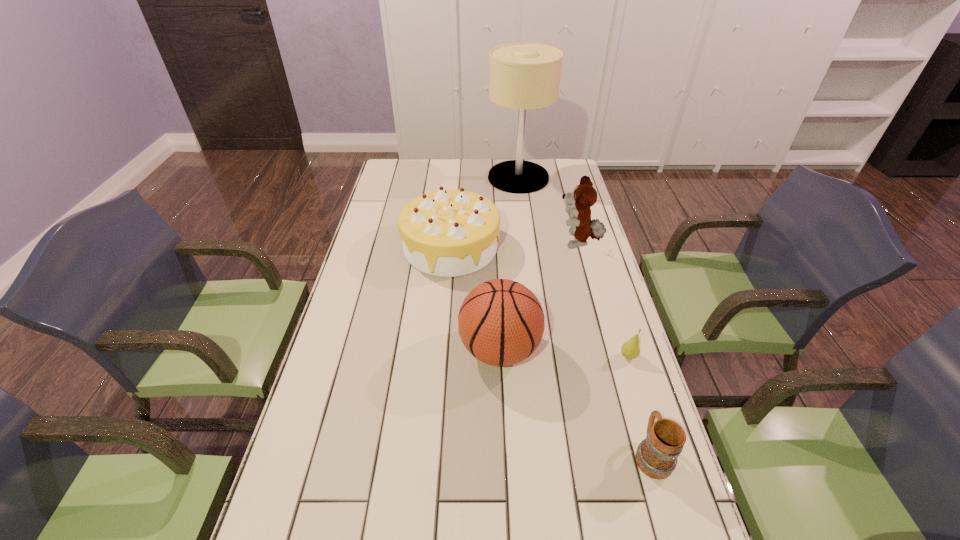
I want to click on table lamp, so click(x=522, y=76).

Where is `the tallest object`? Image resolution: width=960 pixels, height=540 pixels. the tallest object is located at coordinates (522, 76).

At what (x,y) coordinates should I click in order to perform the action: click on puppy. Please return your answer as a coordinate pair (x, y). Image resolution: width=960 pixels, height=540 pixels. Looking at the image, I should click on (584, 196).

The image size is (960, 540). I want to click on basketball, so click(x=501, y=322).

Locate an element on the screen. birthday cake is located at coordinates (448, 233).

I want to click on mug, so click(656, 456).

I want to click on the fifth tallest object, so click(x=656, y=456).

The image size is (960, 540). In order to click on the shortest object in this screenshot , I will do `click(630, 349)`.

Identify the location of vacant space located 0.110m on the right of the farthest object. (573, 178).

I want to click on blank space located 0.160m on the face of the puppy, so click(x=513, y=244).